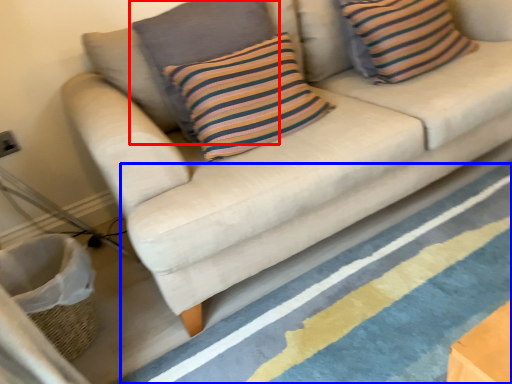
Question: Which object appears farthest to the camera in this image, pillow (highlighted by a red box) or stripe (highlighted by a blue box)?

Choices:
 (A) pillow
 (B) stripe

Answer: (A)